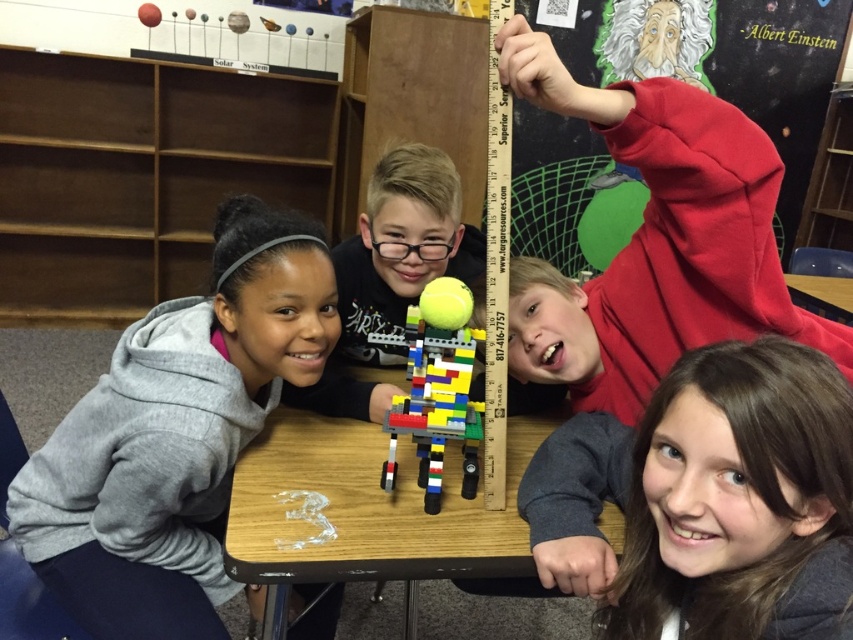
Question: Which object appears closest to the camera in this image?

Choices:
 (A) wooden table at center
 (B) gray fleece hoodie at left
 (C) multicolored plastic lego robot at center

Answer: (A)

Question: Where is gray fleece hoodie at left located in relation to multicolored plastic lego robot at center in the image?

Choices:
 (A) right
 (B) left

Answer: (B)

Question: Is wooden table at center positioned behind multicolored plastic lego robot at center?

Choices:
 (A) yes
 (B) no

Answer: (B)

Question: Which point is closer to the camera?

Choices:
 (A) gray fleece hoodie at left
 (B) wooden table at center
 (C) multicolored plastic lego robot at center

Answer: (B)

Question: Can you confirm if gray fleece hoodie at left is smaller than multicolored plastic lego robot at center?

Choices:
 (A) no
 (B) yes

Answer: (A)

Question: Which point is closer to the camera?

Choices:
 (A) (74, 428)
 (B) (399, 401)

Answer: (B)